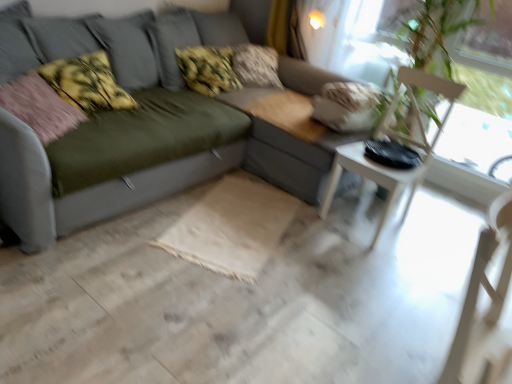
What are the coordinates of `free spot in front of transparent glass window screen at upper right` in the screenshot? It's located at (393, 249).